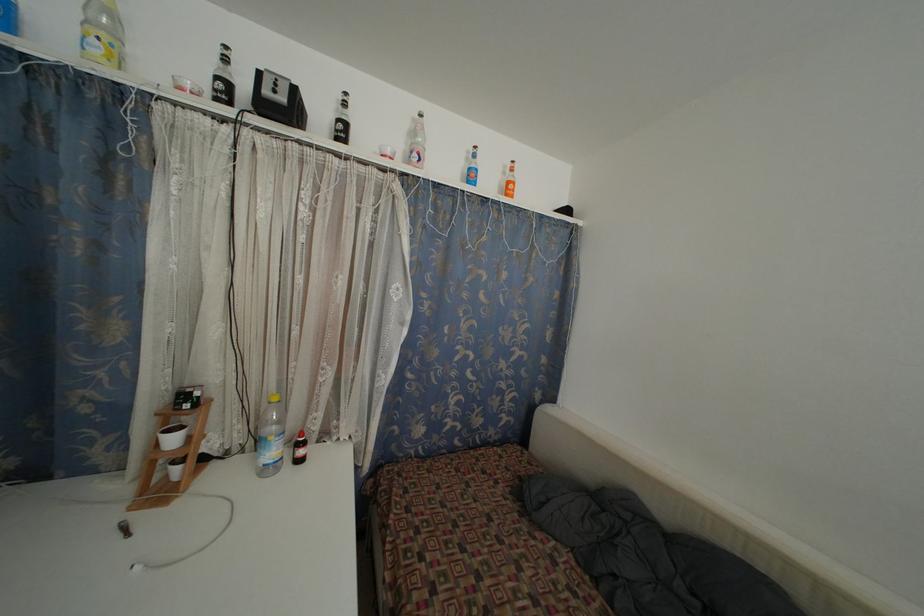
You are a GUI agent. You are given a task and a screenshot of the screen. Output one action in this format:
    pyautogui.click(x=<x>, y=<y>)
    Task: Click on the pink plastic bottle
    The image size is (924, 616).
    Given the screenshot: What is the action you would take?
    pyautogui.click(x=416, y=142)